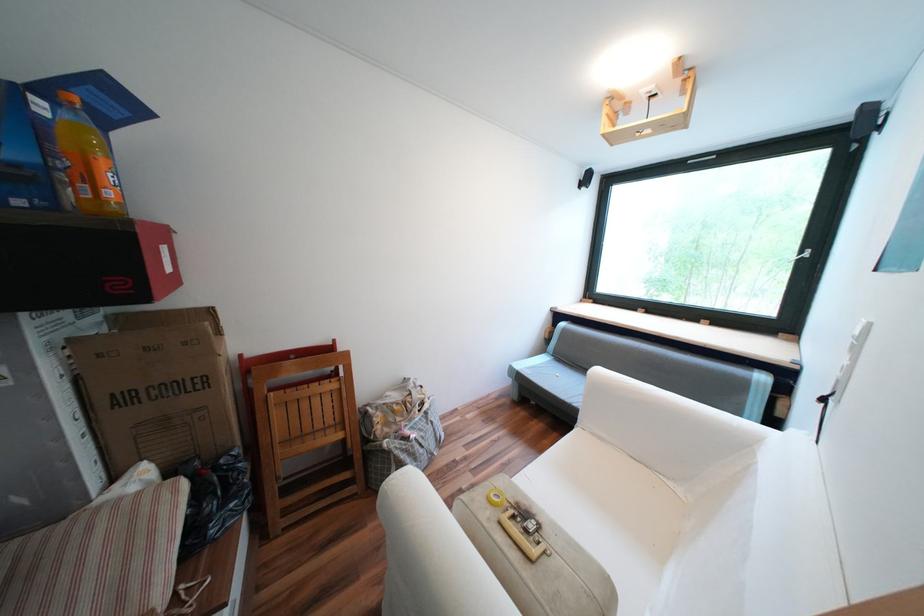
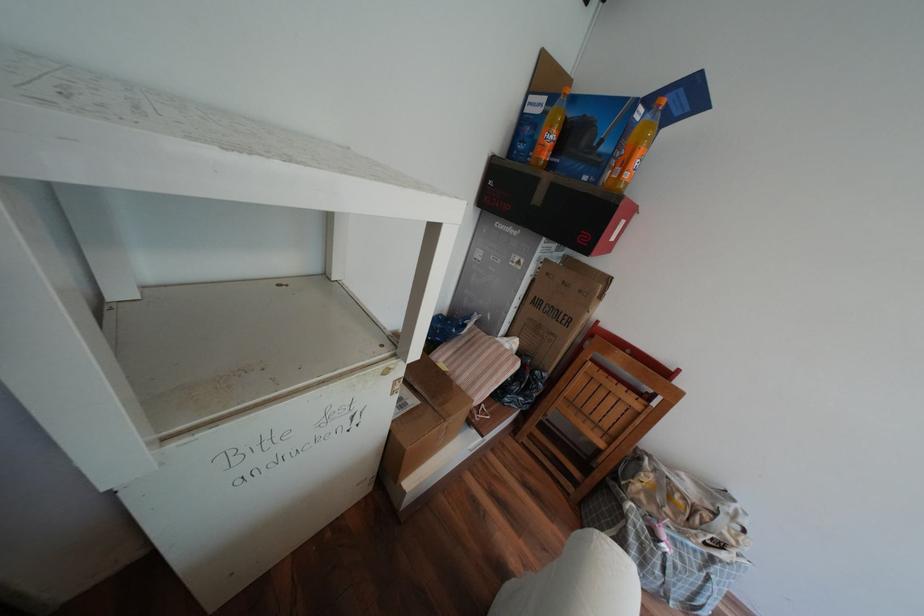
Find the pixel in the second image that matches point (56, 168) in the first image.

(621, 156)